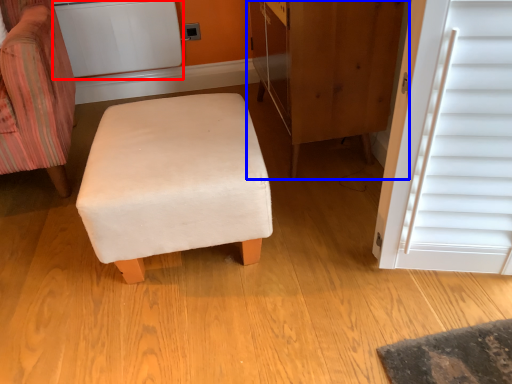
Question: Which point is closer to the camera, appliance (highlighted by a red box) or dresser (highlighted by a blue box)?

Choices:
 (A) appliance
 (B) dresser

Answer: (B)